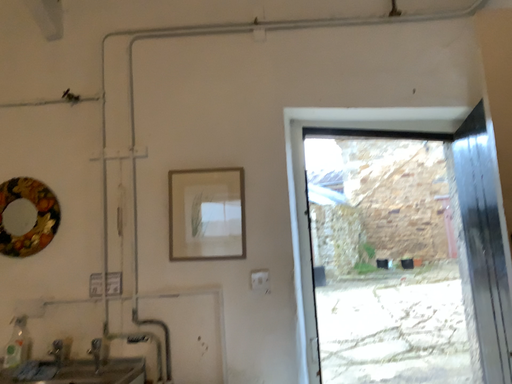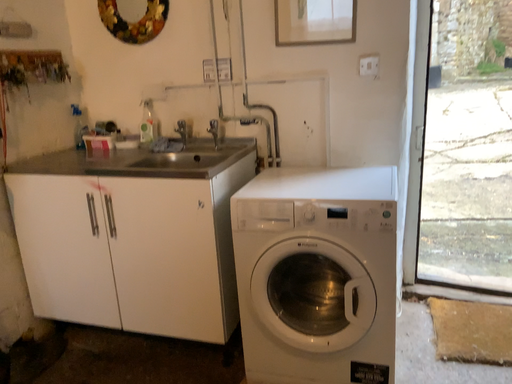
Question: Which way did the camera rotate in the video?

Choices:
 (A) rotated upward
 (B) rotated downward

Answer: (B)